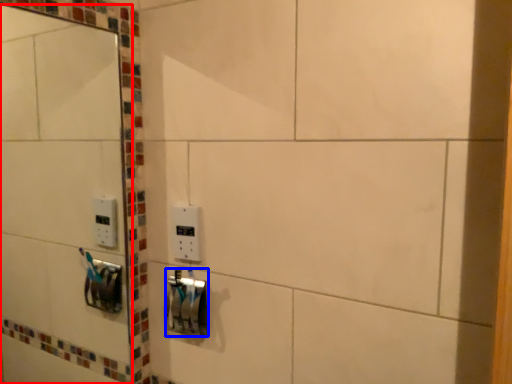
Question: Among these objects, which one is nearest to the camera, mirror (highlighted by a red box) or lock (highlighted by a blue box)?

Choices:
 (A) mirror
 (B) lock

Answer: (A)